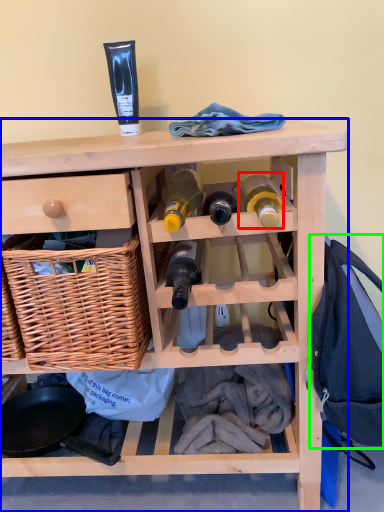
Question: Which object is the farthest from bottle (highlighted by a red box)? Choose among these: furniture (highlighted by a blue box) or clothing (highlighted by a green box).

Choices:
 (A) furniture
 (B) clothing

Answer: (A)